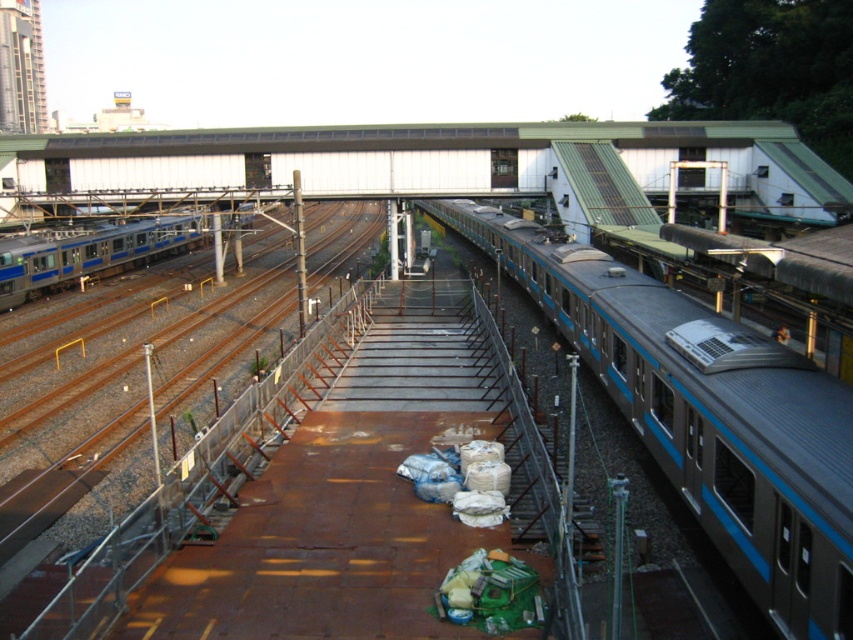
You are a station worker who needs to move a heavy tool from the platform to the blue metallic train at center. The tool requires a direct path to the train without crossing any train tracks. Given that the brown metal train track at center is the only track between you and the train, is it possible to safely move the tool to the train without crossing the track?

The blue metallic train at center is 18.91 meters away from the brown metal train track at center. Since the track is between you and the train, you would need to cross it to reach the train. Therefore, it is not possible to move the tool directly without crossing the brown metal train track at center.

You are a maintenance worker on the platform. You need to cross from the platform to the silver metallic train at left without stepping on the brown metal train track at center. Is this possible?

The brown metal train track at center is above the silver metallic train at left, so you can safely step between them without touching the track by going underneath the track.

You are a passenger waiting at the railway station. You see the blue metallic train at center and the brown metal train track at center. Which one is closer to you?

The blue metallic train at center is closer to you because it is in front of the brown metal train track at center.